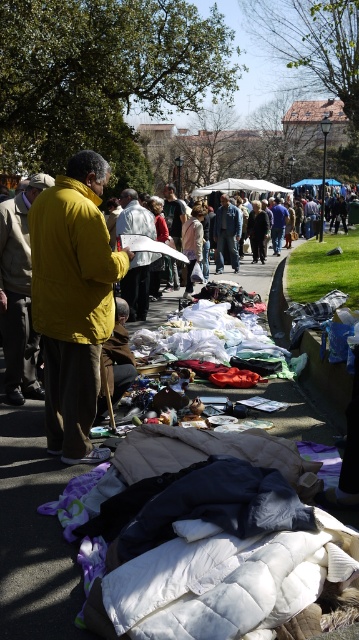
You are a customer at the flea market and want to pick up the yellow matte jacket at left and the white quilted mattress at center. Which item should you approach first to reach them both efficiently?

You should approach the yellow matte jacket at left first since it is closer to you than the white quilted mattress at center, allowing you to pick up both items efficiently.

You are a customer at this flea market and want to pick up both the yellow matte jacket at left and the white quilted mattress at center. If you are standing at the starting point, which item should you reach for first if you want to minimize the distance you walk?

The yellow matte jacket at left should be reached first since it is closer to the starting point than the white quilted mattress at center, which is 2.06 meters away from it.

You are a customer at the flea market holding a tape measure. You want to know how far you are from the yellow matte jacket at left. Can you determine the distance without moving from your current position?

The yellow matte jacket at left and viewer are 4.35 meters apart from each other, so you are 4.35 meters away from the yellow matte jacket at left.